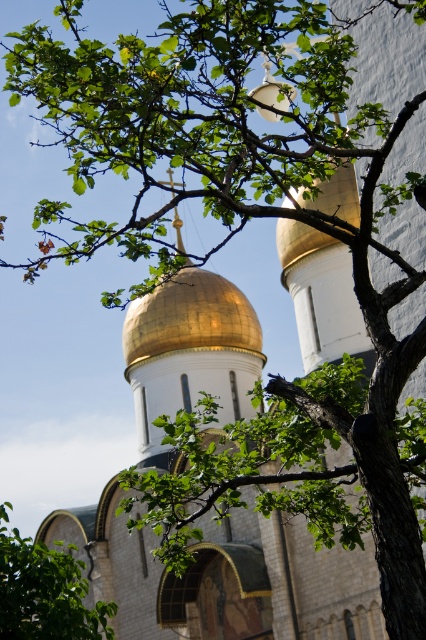
Is gold polished dome at center further to the viewer compared to green leafy branch at lower left?

That is True.

Is gold polished dome at center taller than green leafy branch at lower left?

Yes.

Is point (247, 348) in front of point (13, 595)?

No, (247, 348) is behind (13, 595).

I want to click on gold polished dome at center, so pyautogui.click(x=190, y=317).